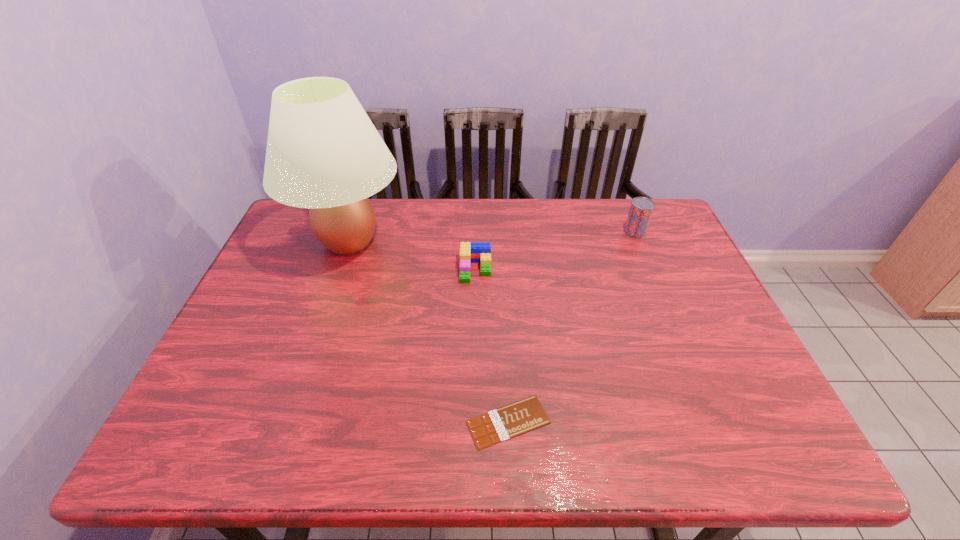
This screenshot has width=960, height=540. What are the coordinates of `free region that satisfies the following two spatial constraints: 1. on the shade of the lampshade; 2. on the left side of the Lego` in the screenshot? It's located at (339, 269).

Locate an element on the screen. This screenshot has height=540, width=960. vacant space that satisfies the following two spatial constraints: 1. on the shade of the Lego; 2. on the right side of the leftmost object is located at coordinates (339, 269).

You are a GUI agent. You are given a task and a screenshot of the screen. Output one action in this format:
    pyautogui.click(x=<x>, y=<y>)
    Task: Click on the vacant space that satisfies the following two spatial constraints: 1. on the shade of the lampshade; 2. on the left side of the second shortest object
    This screenshot has height=540, width=960.
    Given the screenshot: What is the action you would take?
    pyautogui.click(x=339, y=269)

Locate an element on the screen. free space in the image that satisfies the following two spatial constraints: 1. on the shade of the lampshade; 2. on the back side of the nearest object is located at coordinates (286, 422).

In order to click on vacant space that satisfies the following two spatial constraints: 1. on the shade of the shortest object; 2. on the right side of the lampshade in this screenshot , I will do `click(286, 422)`.

The width and height of the screenshot is (960, 540). Find the location of `blank area in the image that satisfies the following two spatial constraints: 1. on the shade of the nearest object; 2. on the left side of the leftmost object`. blank area in the image that satisfies the following two spatial constraints: 1. on the shade of the nearest object; 2. on the left side of the leftmost object is located at coordinates (286, 422).